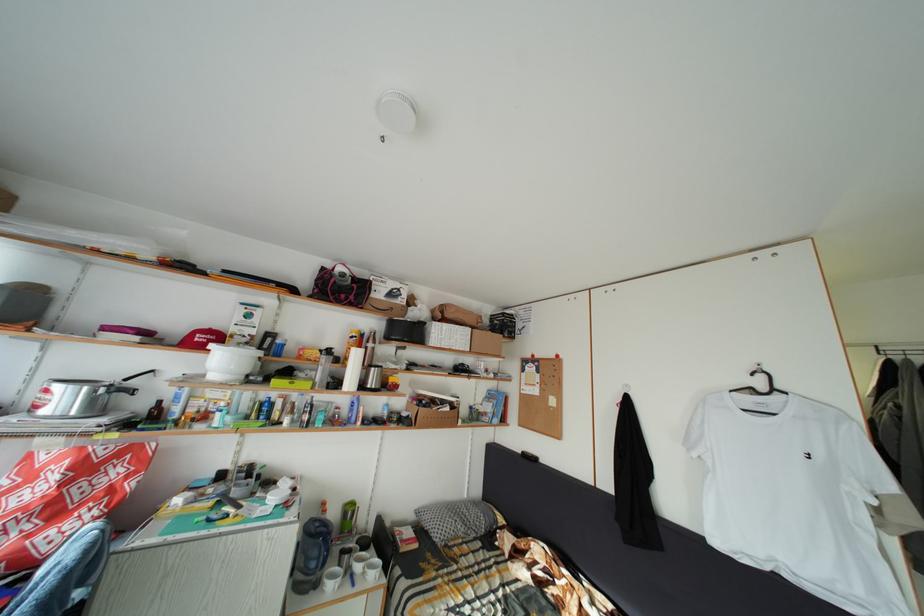
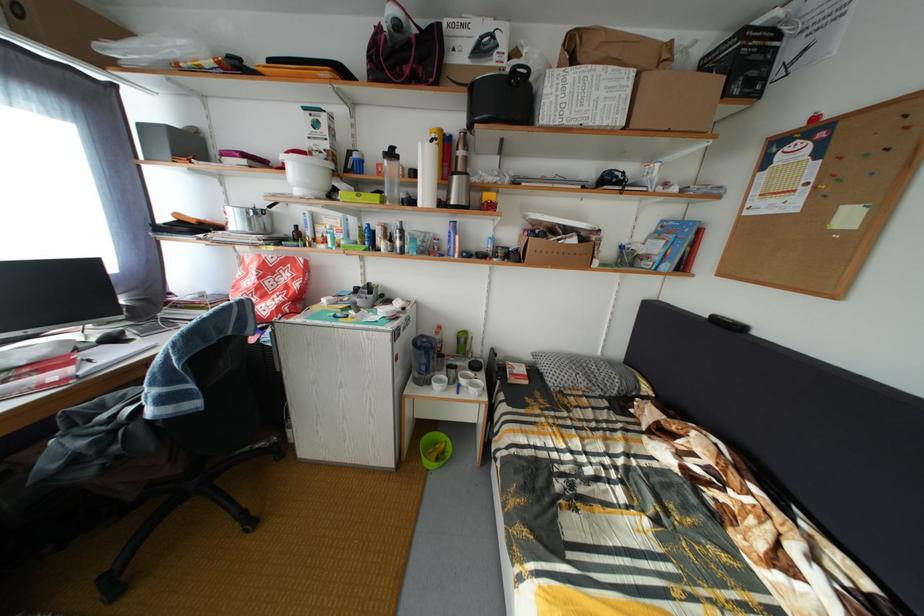
The point at (360, 582) is marked in the first image. Where is the corresponding point in the second image?

(468, 392)